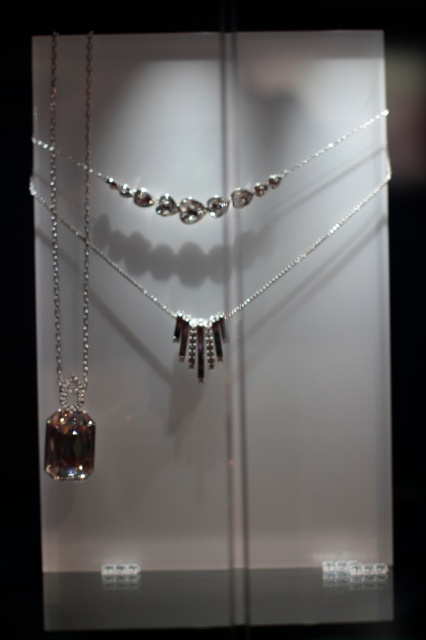
Question: In this image, where is shiny silver necklace at center located relative to silver metallic chain at left?

Choices:
 (A) below
 (B) above

Answer: (A)

Question: Which of the following is the closest to the observer?

Choices:
 (A) silver metallic chain at left
 (B) shiny silver chain at left

Answer: (B)

Question: Which object is positioned closest to the shiny silver chain at left?

Choices:
 (A) silver metallic chain at left
 (B) shiny silver necklace at center

Answer: (A)

Question: Is shiny silver chain at left above silver metallic chain at left?

Choices:
 (A) no
 (B) yes

Answer: (A)

Question: Does shiny silver chain at left have a lesser width compared to silver metallic chain at left?

Choices:
 (A) yes
 (B) no

Answer: (A)

Question: Which point appears farthest from the camera in this image?

Choices:
 (A) (176, 211)
 (B) (78, 397)
 (C) (51, 140)

Answer: (A)